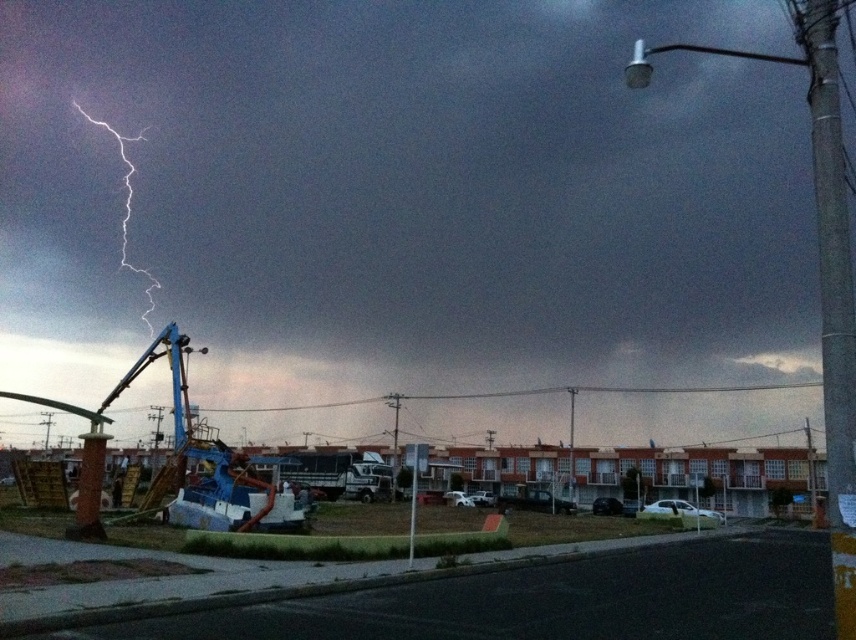
Who is shorter, metallic lightning bolt at upper left or metallic pole at center?

Standing shorter between the two is metallic pole at center.

Who is taller, metallic lightning bolt at upper left or metallic pole at center?

With more height is metallic lightning bolt at upper left.

This screenshot has height=640, width=856. Identify the location of metallic lightning bolt at upper left. (402, 196).